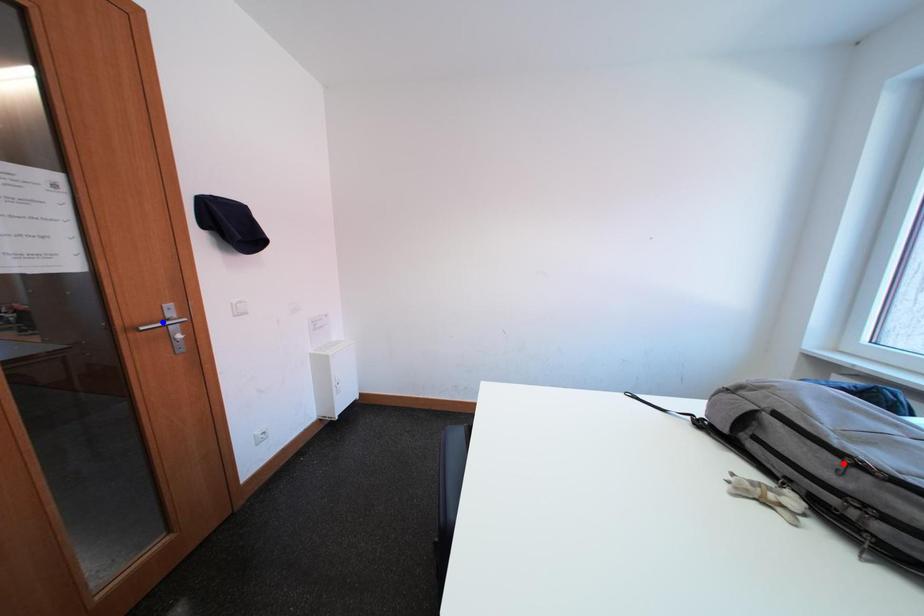
Question: In the image, two points are highlighted. Which point is nearer to the camera? Reply with the corresponding letter.

Choices:
 (A) blue point
 (B) red point

Answer: (B)